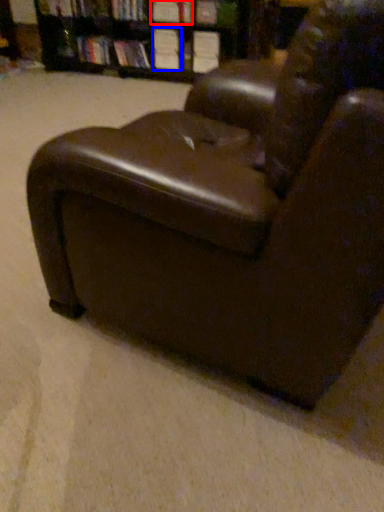
Question: Which point is closer to the camera, book (highlighted by a red box) or book (highlighted by a blue box)?

Choices:
 (A) book
 (B) book

Answer: (A)